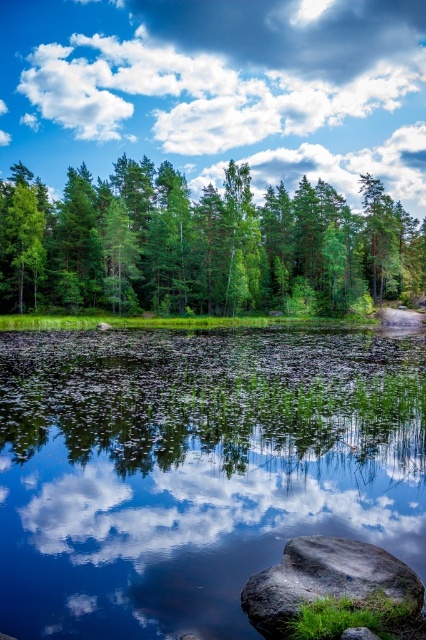
You are standing at the edge of the water in the scene. There is a point marked at coordinates (199, 244). What can you see at that point?

At point (199, 244) lies green leafy trees at center.

You are standing at the origin point in the image and want to reach the point labeled as point (350, 577). There is an obstacle at point (28, 179). Will you encounter this obstacle before reaching your destination?

Point (28, 179) is behind point (350, 577), so you will not encounter the obstacle at point (28, 179) before reaching your destination point (350, 577).